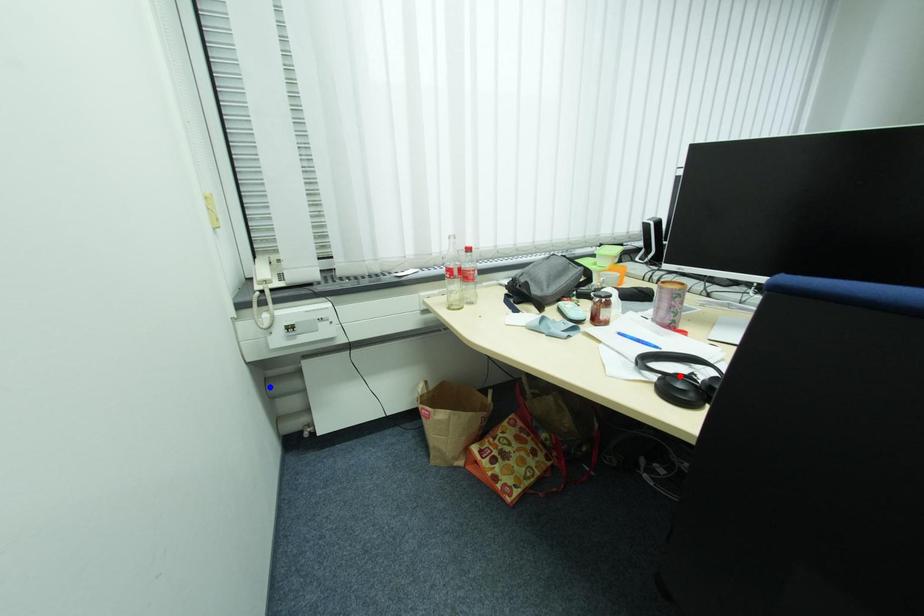
Question: In the image, two points are highlighted. Which point is nearer to the camera? Reply with the corresponding letter.

Choices:
 (A) blue point
 (B) red point

Answer: (B)